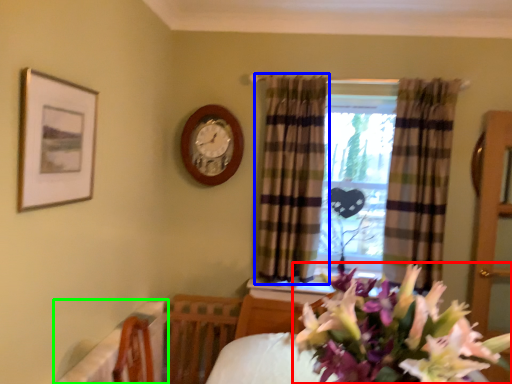
Question: Considering the real-world distances, which object is farthest from flower (highlighted by a red box)? curtain (highlighted by a blue box) or table (highlighted by a green box)?

Choices:
 (A) curtain
 (B) table

Answer: (A)